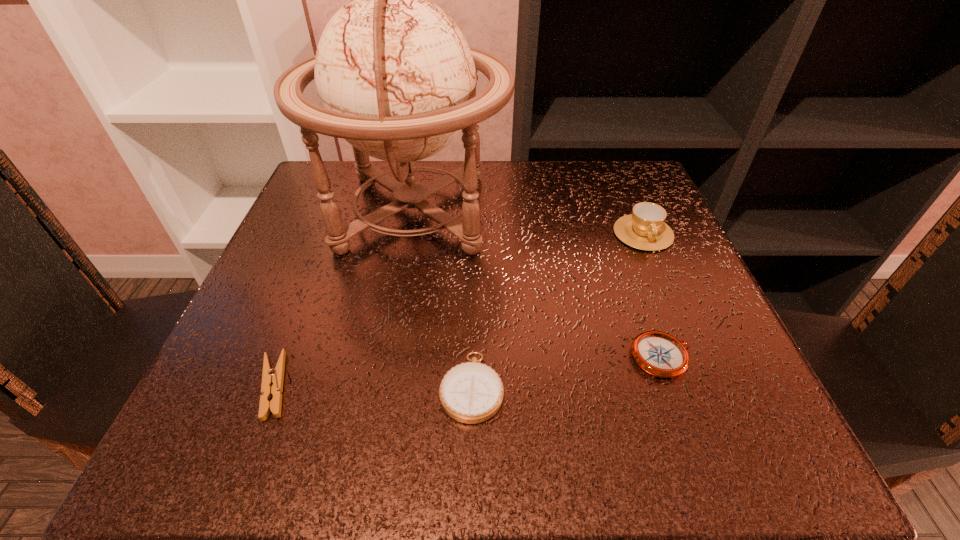
This screenshot has height=540, width=960. What are the coordinates of `object at the far right corner` in the screenshot? It's located at (645, 229).

Identify the location of free region at the far edge. (573, 219).

In the image, there is a desktop. Identify the location of vacant space at the near edge. The height and width of the screenshot is (540, 960). (544, 438).

This screenshot has width=960, height=540. Find the location of `free spot at the left edge of the desktop`. free spot at the left edge of the desktop is located at coordinates (272, 287).

This screenshot has height=540, width=960. In order to click on free point at the right edge in this screenshot , I will do `click(713, 312)`.

The width and height of the screenshot is (960, 540). In order to click on free space at the far left corner of the desktop in this screenshot , I will do (x=309, y=184).

You are a GUI agent. You are given a task and a screenshot of the screen. Output one action in this format:
    pyautogui.click(x=<x>, y=<y>)
    Task: Click on the vacant space at the near left corner
    This screenshot has height=540, width=960.
    Given the screenshot: What is the action you would take?
    pyautogui.click(x=277, y=464)

In the image, there is a desktop. Where is `blank space at the far right corner`? blank space at the far right corner is located at coordinates (610, 171).

At what (x,y) coordinates should I click in order to perform the action: click on vacant point located between the right compass and the left compass. Please return your answer as a coordinate pair (x, y). Looking at the image, I should click on (567, 372).

The width and height of the screenshot is (960, 540). I want to click on unoccupied area between the fourth shortest object and the left compass, so click(558, 310).